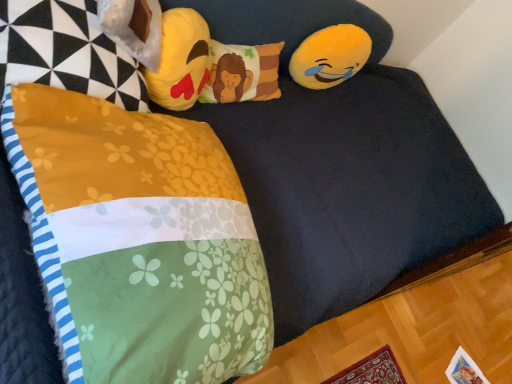
Question: From a real-world perspective, is fluffy floral blanket at lower left, which is counted as the 1th pillow, starting from the bottom, over floral fabric pillow at center, which ranks as the 1th pillow in top-to-bottom order?

Choices:
 (A) no
 (B) yes

Answer: (B)

Question: Is fluffy floral blanket at lower left, marked as the second pillow in a top-to-bottom arrangement, facing towards floral fabric pillow at center, arranged as the first pillow when viewed from the back?

Choices:
 (A) yes
 (B) no

Answer: (B)

Question: Is fluffy floral blanket at lower left, the second pillow when ordered from back to front, at the left side of floral fabric pillow at center, which ranks as the 1th pillow in top-to-bottom order?

Choices:
 (A) yes
 (B) no

Answer: (A)

Question: Is fluffy floral blanket at lower left, the 1th pillow when ordered from front to back, facing away from floral fabric pillow at center, which ranks as the 1th pillow in top-to-bottom order?

Choices:
 (A) yes
 (B) no

Answer: (B)

Question: From the image's perspective, is fluffy floral blanket at lower left, the 1th pillow when ordered from front to back, on top of floral fabric pillow at center, which ranks as the 1th pillow in top-to-bottom order?

Choices:
 (A) yes
 (B) no

Answer: (B)

Question: Is soft yellow plush emoji at upper center, the first toy positioned from the left, bigger or smaller than floral fabric pillow at center, arranged as the first pillow when viewed from the back?

Choices:
 (A) small
 (B) big

Answer: (B)

Question: Is point pyautogui.click(x=165, y=54) closer or farther from the camera than point pyautogui.click(x=272, y=97)?

Choices:
 (A) closer
 (B) farther

Answer: (A)

Question: Do you think soft yellow plush emoji at upper center, the first toy positioned from the front, is within floral fabric pillow at center, acting as the 2th pillow starting from the front, or outside of it?

Choices:
 (A) outside
 (B) inside

Answer: (A)

Question: Considering the positions of soft yellow plush emoji at upper center, the first toy positioned from the left, and floral fabric pillow at center, which ranks as the 1th pillow in top-to-bottom order, in the image, is soft yellow plush emoji at upper center, the first toy positioned from the left, wider or thinner than floral fabric pillow at center, which ranks as the 1th pillow in top-to-bottom order,?

Choices:
 (A) thin
 (B) wide

Answer: (A)

Question: From their relative heights in the image, would you say yellow plush emoji at upper right, the first toy positioned from the right, is taller or shorter than fluffy floral blanket at lower left, marked as the second pillow in a top-to-bottom arrangement?

Choices:
 (A) short
 (B) tall

Answer: (A)

Question: Considering the positions of yellow plush emoji at upper right, which is the first toy in back-to-front order, and fluffy floral blanket at lower left, the second pillow when ordered from back to front, in the image, is yellow plush emoji at upper right, which is the first toy in back-to-front order, wider or thinner than fluffy floral blanket at lower left, the second pillow when ordered from back to front,?

Choices:
 (A) wide
 (B) thin

Answer: (B)

Question: Is yellow plush emoji at upper right, which is the 2th toy in front-to-back order, in front of or behind fluffy floral blanket at lower left, the 1th pillow when ordered from front to back, in the image?

Choices:
 (A) behind
 (B) front

Answer: (A)

Question: In terms of size, does yellow plush emoji at upper right, which is the first toy in back-to-front order, appear bigger or smaller than fluffy floral blanket at lower left, the second pillow when ordered from back to front?

Choices:
 (A) big
 (B) small

Answer: (B)

Question: Is floral fabric pillow at center, acting as the 2th pillow starting from the front, taller or shorter than fluffy floral blanket at lower left, marked as the second pillow in a top-to-bottom arrangement?

Choices:
 (A) short
 (B) tall

Answer: (A)

Question: Considering the positions of floral fabric pillow at center, arranged as the first pillow when viewed from the back, and fluffy floral blanket at lower left, the 1th pillow when ordered from front to back, in the image, is floral fabric pillow at center, arranged as the first pillow when viewed from the back, wider or thinner than fluffy floral blanket at lower left, the 1th pillow when ordered from front to back,?

Choices:
 (A) thin
 (B) wide

Answer: (A)